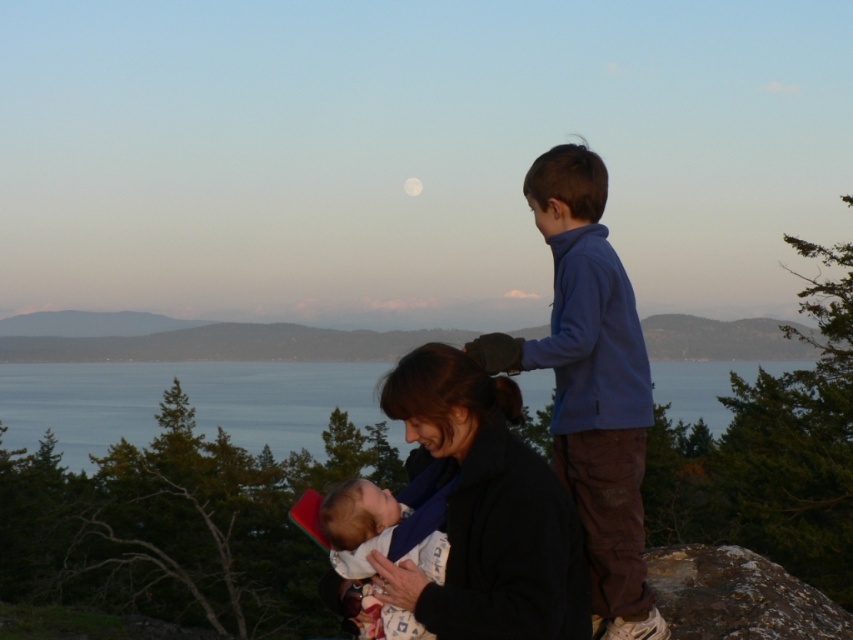
Is point (546, 525) closer to camera compared to point (428, 541)?

Yes.

Does black soft jacket at center have a larger size compared to soft white fabric at center?

Indeed, black soft jacket at center has a larger size compared to soft white fabric at center.

The width and height of the screenshot is (853, 640). What do you see at coordinates (485, 509) in the screenshot? I see `black soft jacket at center` at bounding box center [485, 509].

You are a GUI agent. You are given a task and a screenshot of the screen. Output one action in this format:
    pyautogui.click(x=<x>, y=<y>)
    Task: Click on the black soft jacket at center
    The height and width of the screenshot is (640, 853).
    Given the screenshot: What is the action you would take?
    pyautogui.click(x=485, y=509)

Does blue water at center have a lesser height compared to soft white fabric at center?

No.

Find the location of a particular element. blue water at center is located at coordinates (189, 400).

Who is taller, blue fleece jacket at upper right or soft white fabric at center?

soft white fabric at center

Is point (566, 150) less distant than point (354, 493)?

No.

At what (x,y) coordinates should I click in order to perform the action: click on blue fleece jacket at upper right. Please return your answer as a coordinate pair (x, y). Looking at the image, I should click on (590, 385).